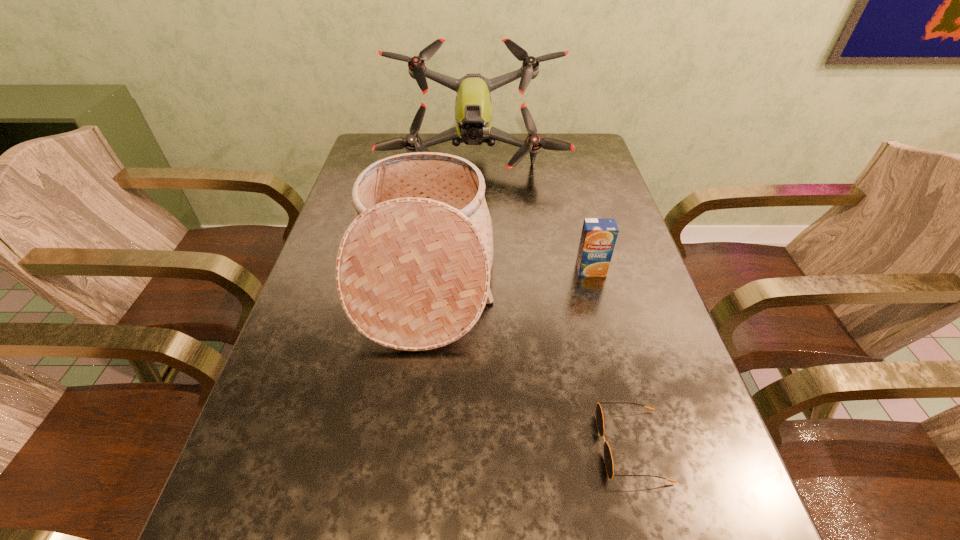
At what (x,y) coordinates should I click in order to perform the action: click on vacant space that's between the second tallest object and the shortest object. Please return your answer as a coordinate pair (x, y). Looking at the image, I should click on (528, 361).

The image size is (960, 540). I want to click on object that can be found as the third closest to the third shortest object, so click(608, 459).

Locate an element on the screen. The image size is (960, 540). the third closest object relative to the sunglasses is located at coordinates (473, 112).

Find the location of a particular element. This screenshot has height=540, width=960. vacant space that satisfies the following two spatial constraints: 1. on the front-facing side of the farthest object; 2. with the lid open on the third shortest object is located at coordinates (471, 276).

Identify the location of vacant area that satisfies the following two spatial constraints: 1. on the front-facing side of the orange_juice; 2. on the right side of the tallest object. This screenshot has height=540, width=960. (x=471, y=271).

Locate an element on the screen. This screenshot has width=960, height=540. vacant space that satisfies the following two spatial constraints: 1. on the front side of the orange_juice; 2. on the front-facing side of the shortest object is located at coordinates (637, 446).

Find the location of a particular element. free space that satisfies the following two spatial constraints: 1. on the front-facing side of the third tallest object; 2. on the right side of the tallest object is located at coordinates (471, 271).